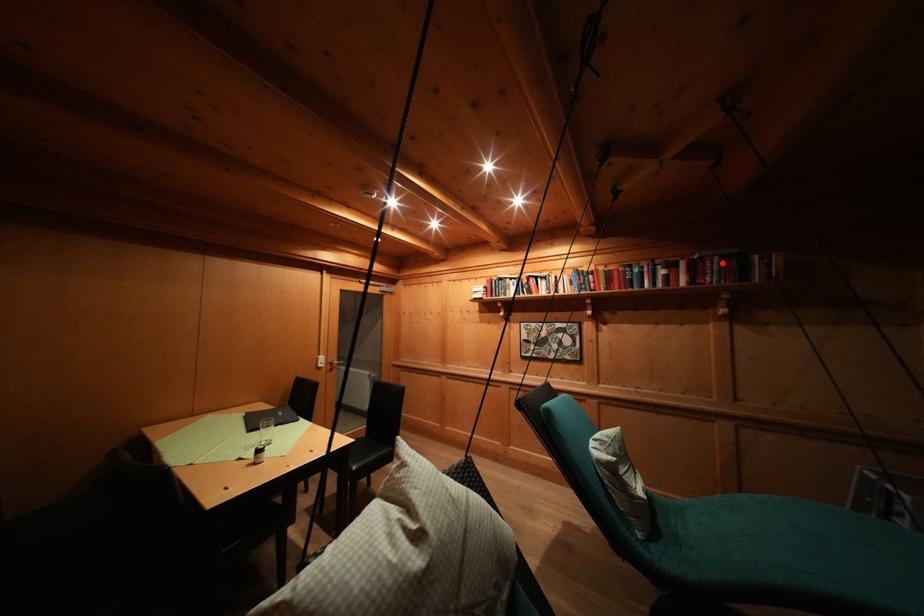
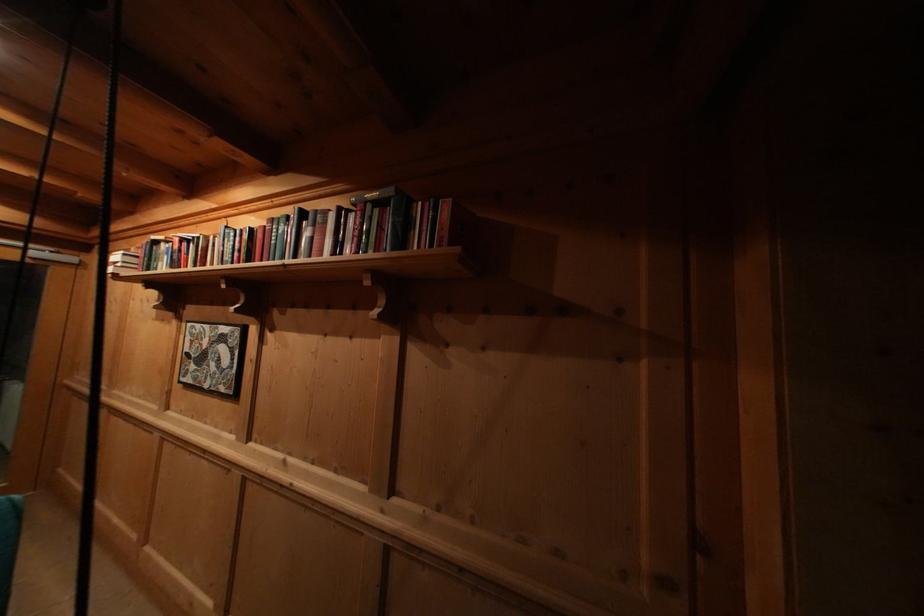
Where in the second image is the point corresponding to the highlighted location from the first image?

(375, 211)